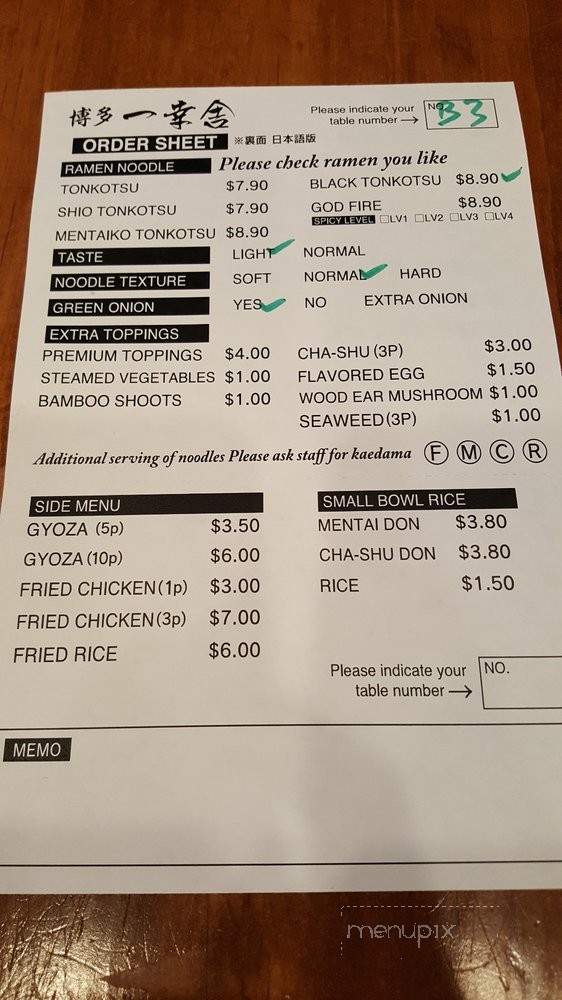
At what (x,y) coordinates should I click in order to perform the action: click on table number. Please return your answer as a coordinate pair (x, y). The width and height of the screenshot is (562, 1000). Looking at the image, I should click on (432, 109).